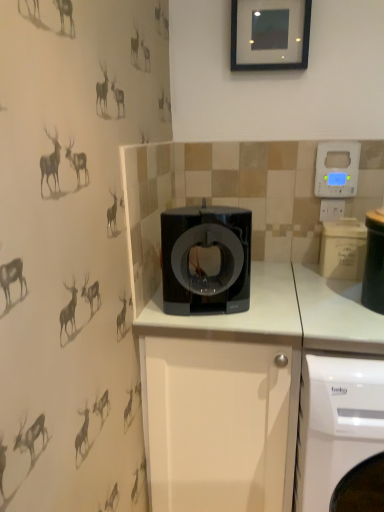
Identify the location of free space in front of black glossy coffee machine at center. click(212, 325).